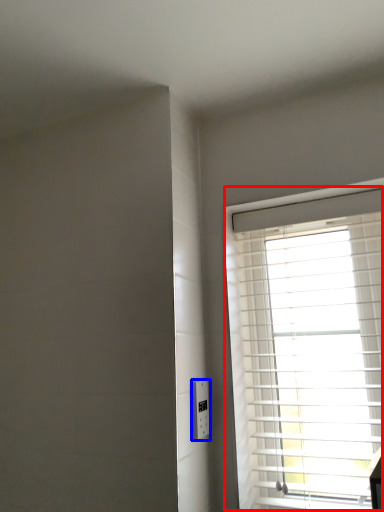
Question: Among these objects, which one is nearest to the camera, window (highlighted by a red box) or electric outlet (highlighted by a blue box)?

Choices:
 (A) window
 (B) electric outlet

Answer: (A)